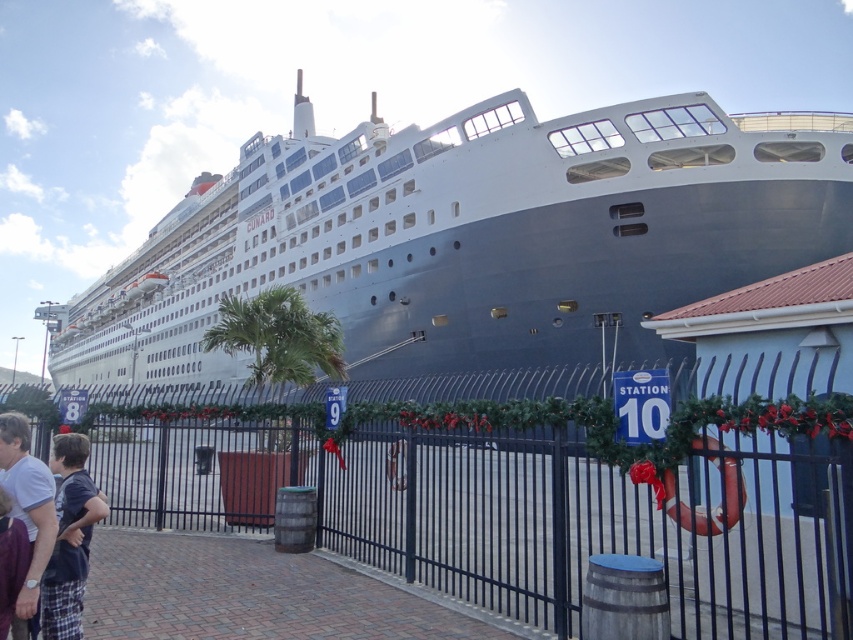
Does black metal fence at center appear over dark blue cotton shirt at lower left?

No.

Which is behind, point (801, 448) or point (44, 557)?

The point (801, 448) is behind.

You are a GUI agent. You are given a task and a screenshot of the screen. Output one action in this format:
    pyautogui.click(x=<x>, y=<y>)
    Task: Click on the black metal fence at center
    
    Given the screenshot: What is the action you would take?
    [x=527, y=490]

Locate an element on the screen. This screenshot has height=640, width=853. black metal fence at center is located at coordinates (527, 490).

The width and height of the screenshot is (853, 640). What are the coordinates of `white glossy cruise ship at center` in the screenshot? It's located at (473, 236).

Who is positioned more to the right, white glossy cruise ship at center or dark blue cotton shirt at lower left?

dark blue cotton shirt at lower left is more to the right.

Find the location of a particular element. white glossy cruise ship at center is located at coordinates (473, 236).

Locate an element on the screen. white glossy cruise ship at center is located at coordinates (473, 236).

Which of these two, white glossy cruise ship at center or black metal fence at center, stands shorter?

With less height is black metal fence at center.

Is point (369, 272) positioned behind point (230, 428)?

Yes, point (369, 272) is farther from viewer.

At what (x,y) coordinates should I click in order to perform the action: click on white glossy cruise ship at center. Please return your answer as a coordinate pair (x, y). The height and width of the screenshot is (640, 853). Looking at the image, I should click on (473, 236).